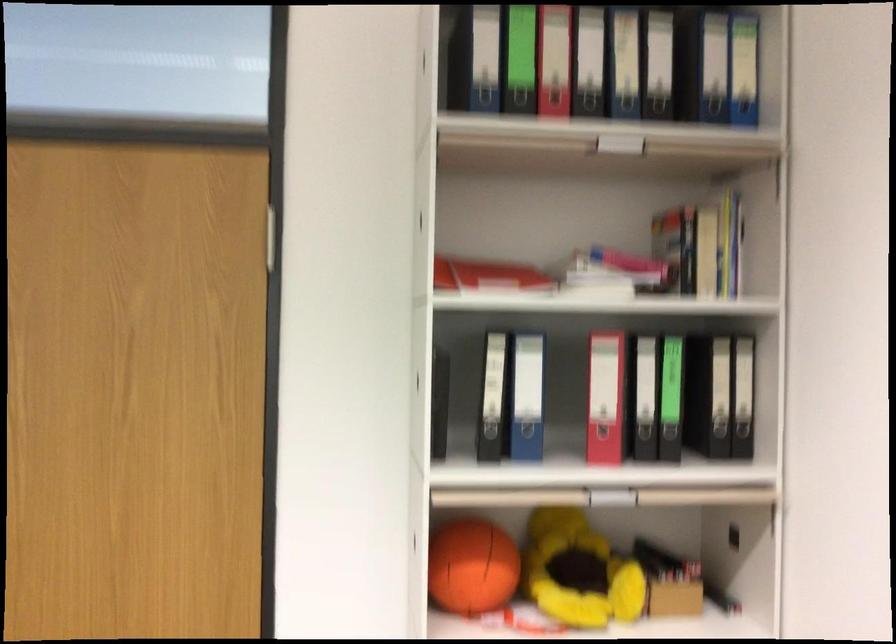
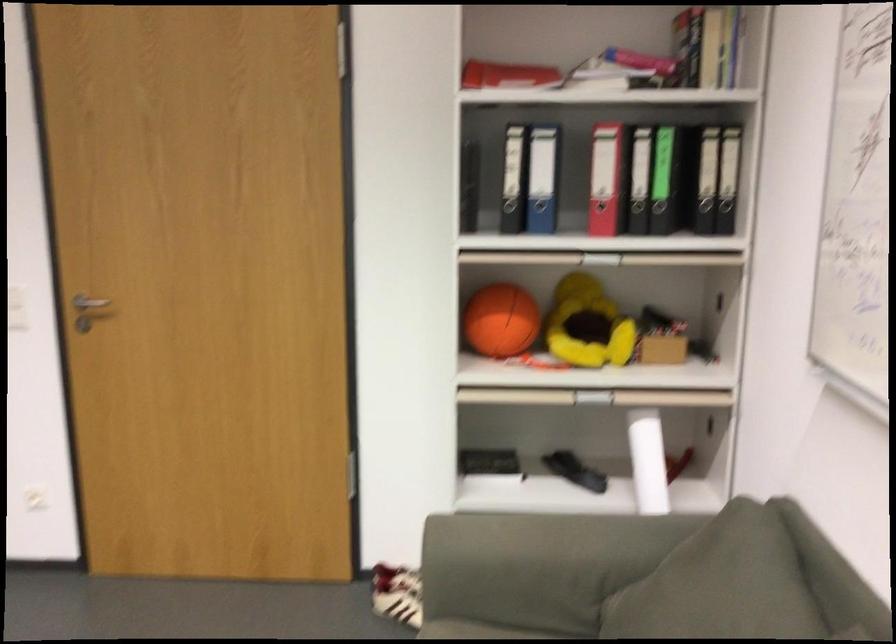
Locate, in the second image, the point that corresponds to point 756,437 in the first image.

(734, 214)